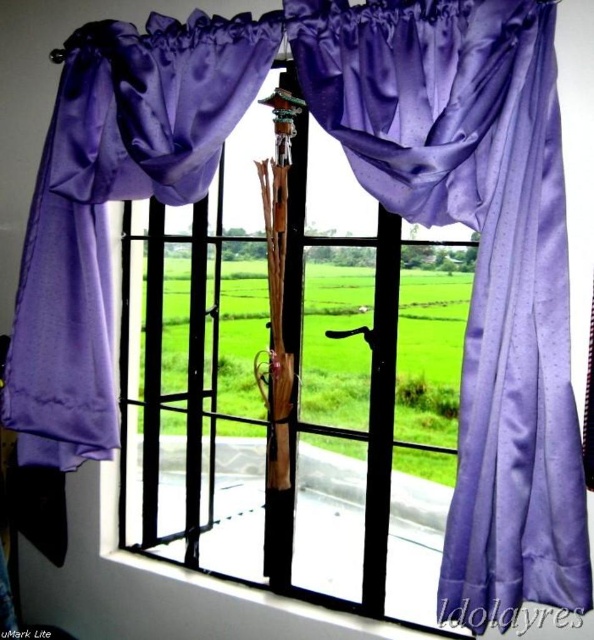
Question: Is satin purple umbrella at center positioned before satin purple curtain at left?

Choices:
 (A) no
 (B) yes

Answer: (A)

Question: Which of the following is the closest to the observer?

Choices:
 (A) satin purple umbrella at center
 (B) satin purple curtain at center
 (C) satin purple curtain at left

Answer: (B)

Question: Is satin purple umbrella at center further to the viewer compared to satin purple curtain at left?

Choices:
 (A) no
 (B) yes

Answer: (B)

Question: Is satin purple umbrella at center to the left of satin purple curtain at left from the viewer's perspective?

Choices:
 (A) yes
 (B) no

Answer: (B)

Question: Estimate the real-world distances between objects in this image. Which object is farther from the satin purple umbrella at center?

Choices:
 (A) satin purple curtain at center
 (B) satin purple curtain at left

Answer: (A)

Question: Which object appears closest to the camera in this image?

Choices:
 (A) satin purple umbrella at center
 (B) satin purple curtain at center

Answer: (B)